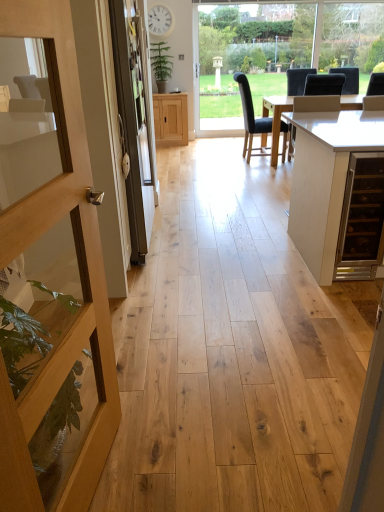
Locate an element on the screen. wooden door at left is located at coordinates (50, 279).

Measure the distance between wooden door at left and camera.

The distance of wooden door at left from camera is 33.42 inches.

You are a GUI agent. You are given a task and a screenshot of the screen. Output one action in this format:
    pyautogui.click(x=<x>, y=<y>)
    Task: Click on the light brown wood cabinet at center
    The image size is (384, 512).
    Given the screenshot: What is the action you would take?
    pyautogui.click(x=170, y=119)

The image size is (384, 512). What do you see at coordinates (161, 61) in the screenshot? I see `green leafy plant at upper center` at bounding box center [161, 61].

What do you see at coordinates (251, 118) in the screenshot? The height and width of the screenshot is (512, 384). I see `black leather chair at center, positioned as the 2th chair in right-to-left order` at bounding box center [251, 118].

What is the approximate width of black leather chair at center, positioned as the 2th chair in right-to-left order?

It is 69.02 centimeters.

You are a GUI agent. You are given a task and a screenshot of the screen. Output one action in this format:
    pyautogui.click(x=<x>, y=<y>)
    Task: Click on the clear glass screen door at left
    This screenshot has height=512, width=384.
    Given the screenshot: What is the action you would take?
    pyautogui.click(x=133, y=123)

Choose the correct answer: Is transparent glass window at center inside green leafy plant at upper center or outside it?

transparent glass window at center is located beyond the bounds of green leafy plant at upper center.

From a real-world perspective, who is located higher, transparent glass window at center or green leafy plant at upper center?

From a 3D spatial view, green leafy plant at upper center is above.

Based on the photo, could you tell me if transparent glass window at center is turned towards green leafy plant at upper center?

No, transparent glass window at center is not facing towards green leafy plant at upper center.

Considering the positions of objects transparent glass window at center and green leafy plant at upper center in the image provided, who is more to the left, transparent glass window at center or green leafy plant at upper center?

Positioned to the left is green leafy plant at upper center.

Can you tell me how much white glossy table at center and clear glass screen door at left differ in facing direction?

The facing directions of white glossy table at center and clear glass screen door at left are 90.4 degrees apart.

Between point (335, 229) and point (138, 17), which one is positioned in front?

Positioned in front is point (335, 229).

Do you think white glossy table at center is within clear glass screen door at left, or outside of it?

white glossy table at center is located beyond the bounds of clear glass screen door at left.

From the picture: Can you confirm if black leather chair at center, positioned as the 2th chair in right-to-left order, is taller than white glossy table at center?

Yes, black leather chair at center, positioned as the 2th chair in right-to-left order, is taller than white glossy table at center.

Is black leather chair at center, positioned as the 2th chair in right-to-left order, next to white glossy table at center?

No, black leather chair at center, positioned as the 2th chair in right-to-left order, is not with white glossy table at center.

Is black leather chair at center, positioned as the 2th chair in right-to-left order, facing away from white glossy table at center?

No, black leather chair at center, positioned as the 2th chair in right-to-left order,'s orientation is not away from white glossy table at center.

Does black leather chair at center, the first chair viewed from the left, have a lesser width compared to white glossy table at center?

Yes.

Considering the relative sizes of wooden door at left and dark gray fabric chair at center, placed as the second chair when sorted from left to right, in the image provided, is wooden door at left taller than dark gray fabric chair at center, placed as the second chair when sorted from left to right,?

Indeed, wooden door at left has a greater height compared to dark gray fabric chair at center, placed as the second chair when sorted from left to right.

Is wooden door at left wider than dark gray fabric chair at center, the 1th chair in the right-to-left sequence?

In fact, wooden door at left might be narrower than dark gray fabric chair at center, the 1th chair in the right-to-left sequence.

Can you tell me how much wooden door at left and dark gray fabric chair at center, the 1th chair in the right-to-left sequence, differ in facing direction?

97.2 degrees separate the facing orientations of wooden door at left and dark gray fabric chair at center, the 1th chair in the right-to-left sequence.

Is clear glass screen door at left spatially inside dark gray fabric chair at center, the 1th chair in the right-to-left sequence, or outside of it?

clear glass screen door at left is not enclosed by dark gray fabric chair at center, the 1th chair in the right-to-left sequence.

Between clear glass screen door at left and dark gray fabric chair at center, the 1th chair in the right-to-left sequence, which one has more height?

Standing taller between the two is clear glass screen door at left.

From the image's perspective, which is above, clear glass screen door at left or dark gray fabric chair at center, the 1th chair in the right-to-left sequence?

dark gray fabric chair at center, the 1th chair in the right-to-left sequence, from the image's perspective.

From a real-world perspective, which is physically above, dark gray fabric chair at center, placed as the second chair when sorted from left to right, or transparent glass window at center?

transparent glass window at center is physically above.

Would you say dark gray fabric chair at center, the 1th chair in the right-to-left sequence, is outside transparent glass window at center?

dark gray fabric chair at center, the 1th chair in the right-to-left sequence, lies outside transparent glass window at center's area.

Which of these two, dark gray fabric chair at center, placed as the second chair when sorted from left to right, or transparent glass window at center, is wider?

With larger width is dark gray fabric chair at center, placed as the second chair when sorted from left to right.

From a real-world perspective, who is located higher, transparent glass window at center or white glossy table at center?

transparent glass window at center.

Are transparent glass window at center and white glossy table at center located far from each other?

Yes, transparent glass window at center is far from white glossy table at center.

Locate an element on the screen. window frame that appears on the left of white glossy table at center is located at coordinates (287, 38).

Locate an element on the screen. plant in front of the transparent glass window at center is located at coordinates pyautogui.click(x=161, y=61).

Image resolution: width=384 pixels, height=512 pixels. I want to click on screen door located above the white glossy table at center (from the image's perspective), so click(133, 123).

When comparing their distances from dark gray fabric chair at center, the 1th chair in the right-to-left sequence, does transparent glass window at center or green leafy plant at upper center seem closer?

Among the two, transparent glass window at center is located nearer to dark gray fabric chair at center, the 1th chair in the right-to-left sequence.

Which object lies further to the anchor point black leather chair at center, the first chair viewed from the left, dark gray fabric chair at center, the 1th chair in the right-to-left sequence, or light brown wood cabinet at center?

dark gray fabric chair at center, the 1th chair in the right-to-left sequence, is further to black leather chair at center, the first chair viewed from the left.

Based on their spatial positions, is black leather chair at center, positioned as the 2th chair in right-to-left order, or green leafy plant at upper center further from wooden door at left?

green leafy plant at upper center is positioned further to the anchor wooden door at left.

Considering their positions, is wooden door at left positioned further to dark gray fabric chair at center, the 1th chair in the right-to-left sequence, than black leather chair at center, positioned as the 2th chair in right-to-left order?

Based on the image, wooden door at left appears to be further to dark gray fabric chair at center, the 1th chair in the right-to-left sequence.

Considering their positions, is white glossy table at center positioned further to transparent glass window at center than black leather chair at center, positioned as the 2th chair in right-to-left order?

white glossy table at center is further to transparent glass window at center.

From the image, which object appears to be nearer to green leafy plant at upper center, light brown wood cabinet at center or transparent glass window at center?

Based on the image, light brown wood cabinet at center appears to be nearer to green leafy plant at upper center.

Which object lies further to the anchor point wooden door at left, green leafy plant at upper center or dark gray fabric chair at center, the 1th chair in the right-to-left sequence?

dark gray fabric chair at center, the 1th chair in the right-to-left sequence, is positioned further to the anchor wooden door at left.

Estimate the real-world distances between objects in this image. Which object is further from white glossy table at center, transparent glass window at center or light brown wood cabinet at center?

transparent glass window at center.

Where is `plant between wooden door at left and light brown wood cabinet at center in the front-back direction`? This screenshot has height=512, width=384. plant between wooden door at left and light brown wood cabinet at center in the front-back direction is located at coordinates tap(161, 61).

Where is `cabinetry situated between green leafy plant at upper center and dark gray fabric chair at center, the 1th chair in the right-to-left sequence, from left to right`? The width and height of the screenshot is (384, 512). cabinetry situated between green leafy plant at upper center and dark gray fabric chair at center, the 1th chair in the right-to-left sequence, from left to right is located at coordinates (170, 119).

You are a GUI agent. You are given a task and a screenshot of the screen. Output one action in this format:
    pyautogui.click(x=<x>, y=<y>)
    Task: Click on the window frame between wooden door at left and light brown wood cabinet at center from front to back
    This screenshot has width=384, height=512.
    Given the screenshot: What is the action you would take?
    pyautogui.click(x=287, y=38)

Where is `window frame between dark gray fabric chair at center, the 1th chair in the right-to-left sequence, and light brown wood cabinet at center from front to back`? The width and height of the screenshot is (384, 512). window frame between dark gray fabric chair at center, the 1th chair in the right-to-left sequence, and light brown wood cabinet at center from front to back is located at coordinates (287, 38).